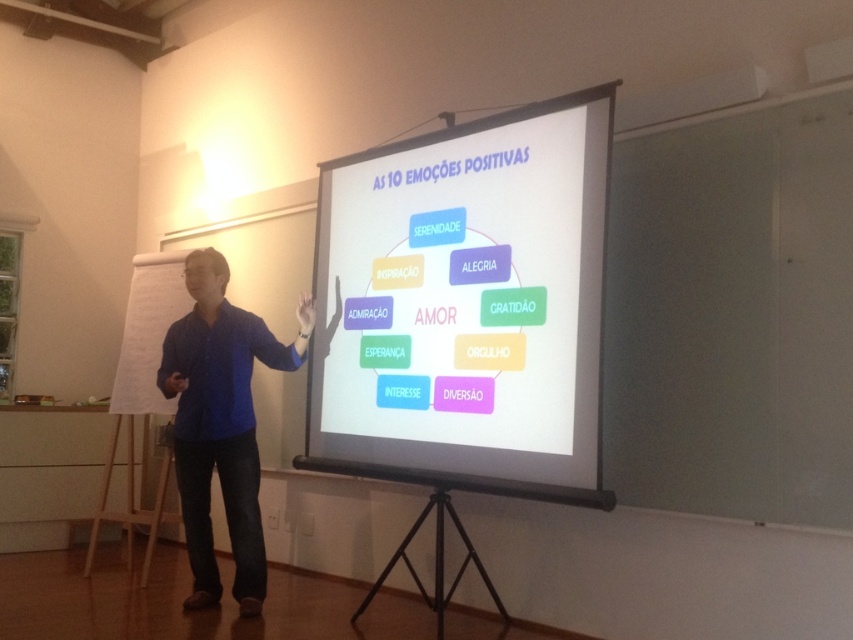
Looking at this image, you are a speaker who needs to ensure that the white matte projection screen at center is visible to all attendees. Considering the blue shirt at center, which object is wider and thus more likely to block the view of the screen?

The white matte projection screen at center is wider than the blue shirt at center, so it is more likely to block the view of the screen.